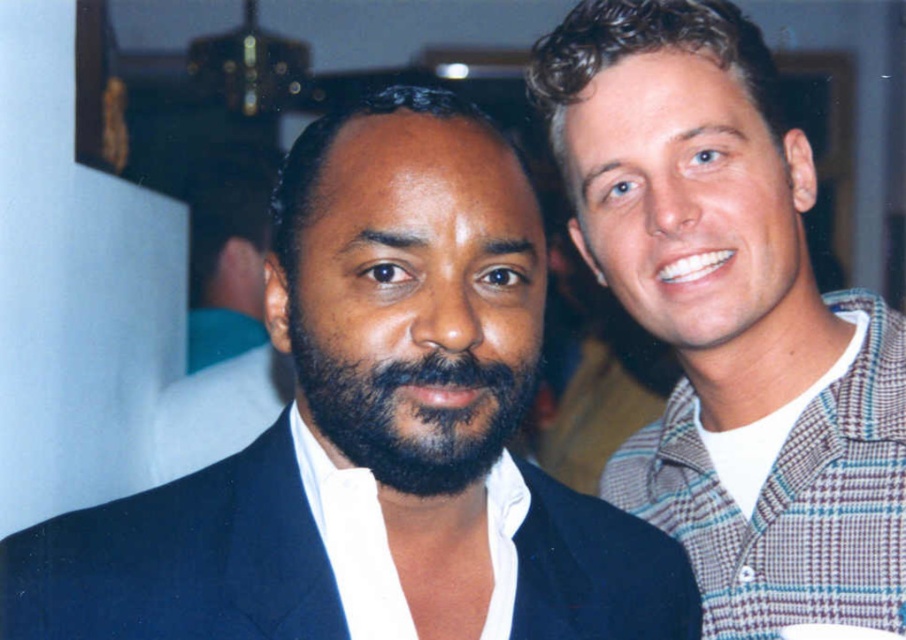
Question: Does plaid shirt at right appear on the right side of dark brown fuzzy beard at center?

Choices:
 (A) yes
 (B) no

Answer: (A)

Question: Estimate the real-world distances between objects in this image. Which object is farther from the dark brown fuzzy beard at center?

Choices:
 (A) dark blue suit at center
 (B) plaid shirt at right

Answer: (B)

Question: Which object is farther from the camera taking this photo?

Choices:
 (A) plaid shirt at right
 (B) dark blue suit at center
 (C) dark brown fuzzy beard at center

Answer: (A)

Question: Is plaid shirt at right bigger than dark brown fuzzy beard at center?

Choices:
 (A) yes
 (B) no

Answer: (A)

Question: Is plaid shirt at right above dark brown fuzzy beard at center?

Choices:
 (A) yes
 (B) no

Answer: (A)

Question: Estimate the real-world distances between objects in this image. Which object is farther from the dark brown fuzzy beard at center?

Choices:
 (A) dark blue suit at center
 (B) plaid shirt at right

Answer: (B)